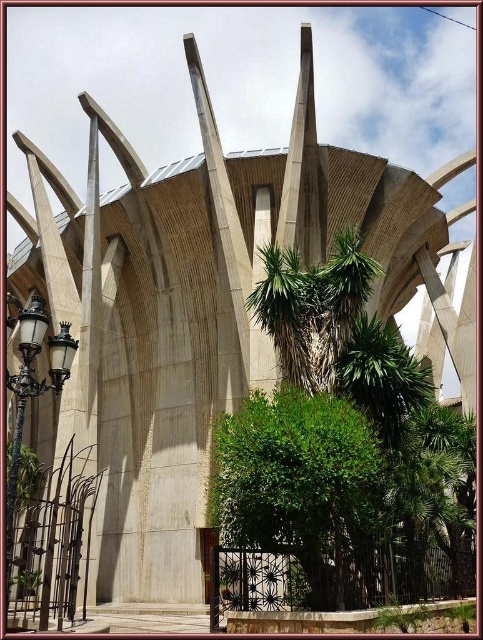
Describe the element at coordinates (339, 448) in the screenshot. The width and height of the screenshot is (483, 640). I see `green leafy tree at center` at that location.

Measure the distance between green leafy tree at center and camera.

green leafy tree at center is 111.24 feet away from camera.

Between point (274, 593) and point (42, 380), which one is positioned in front?

Point (274, 593) is more forward.

Image resolution: width=483 pixels, height=640 pixels. I want to click on green leafy tree at center, so click(339, 448).

Who is positioned more to the left, green leafy bush at center or polished brass streetlight at lower left?

polished brass streetlight at lower left is more to the left.

Can you confirm if green leafy bush at center is bigger than polished brass streetlight at lower left?

No, green leafy bush at center is not bigger than polished brass streetlight at lower left.

Which is in front, point (273, 397) or point (38, 394)?

Point (38, 394) is in front.

This screenshot has width=483, height=640. In order to click on green leafy bush at center in this screenshot , I will do `click(298, 484)`.

Does green leafy tree at center appear under green leafy bush at center?

Incorrect, green leafy tree at center is not positioned below green leafy bush at center.

Between point (471, 420) and point (247, 547), which one is positioned in front?

Point (247, 547) is more forward.

Identify the location of green leafy tree at center. (339, 448).